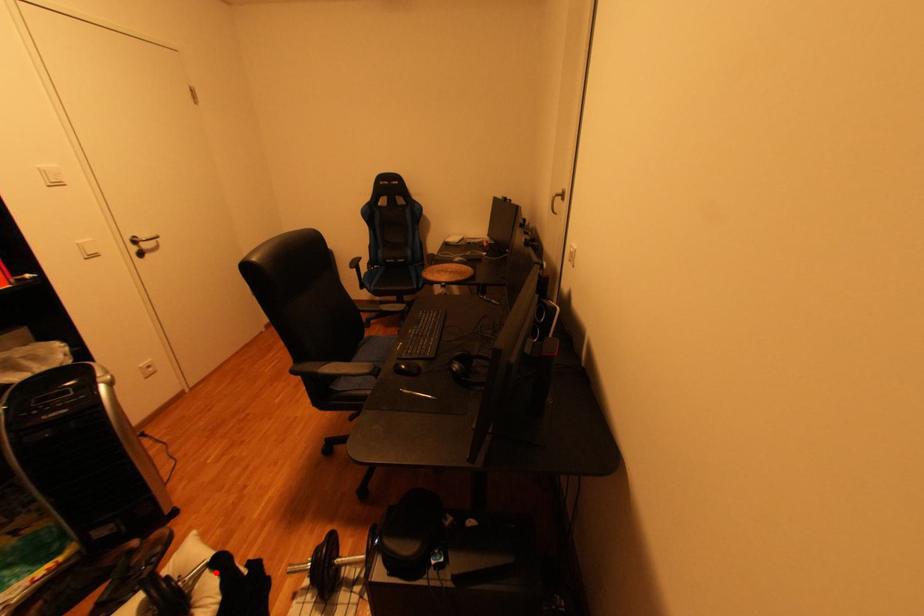
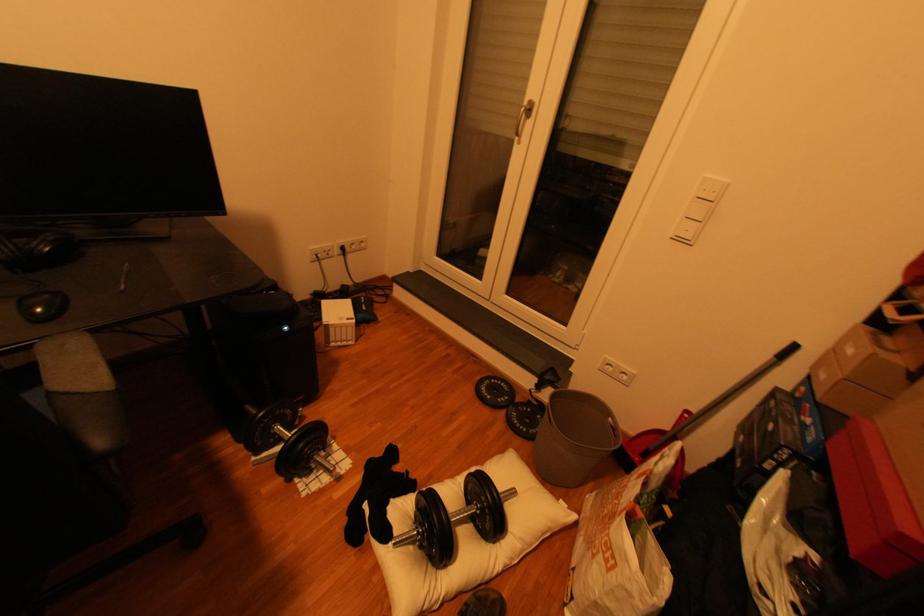
The point at the highlighted location is marked in the first image. Where is the corresponding point in the second image?

(406, 533)